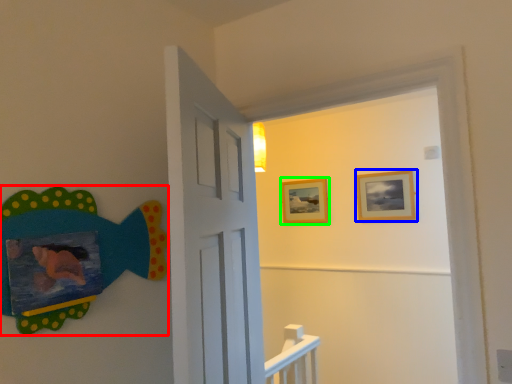
Question: Which is farther away from art (highlighted by a red box)? picture frame (highlighted by a blue box) or picture frame (highlighted by a green box)?

Choices:
 (A) picture frame
 (B) picture frame

Answer: (B)